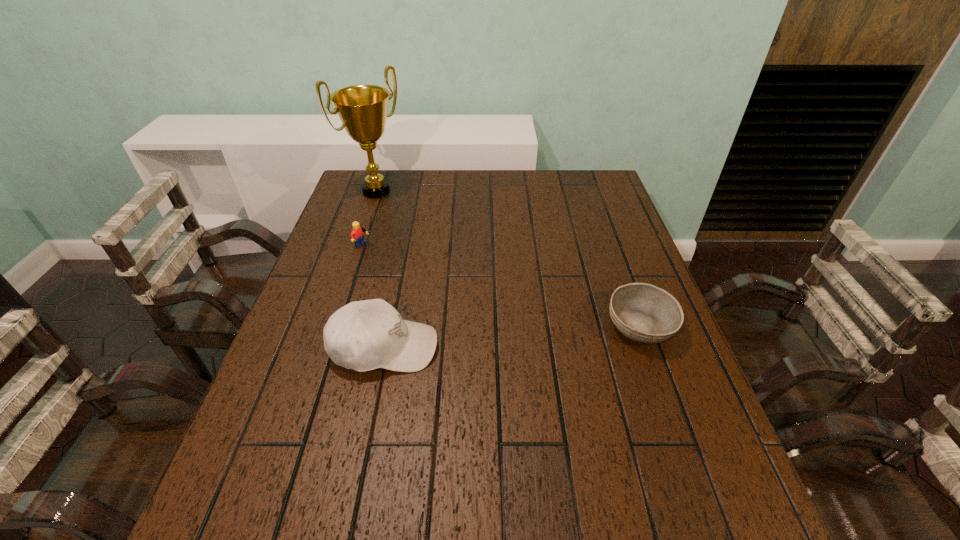
Locate an element on the screen. Image resolution: width=960 pixels, height=540 pixels. free space on the desktop that is between the baseball cap and the shortest object and is positioned on the front-facing side of the second farthest object is located at coordinates (529, 335).

In order to click on vacant space on the desktop that is between the baseball cap and the rightmost object and is positioned on the front view with handles of the tallest object in this screenshot , I will do `click(542, 334)`.